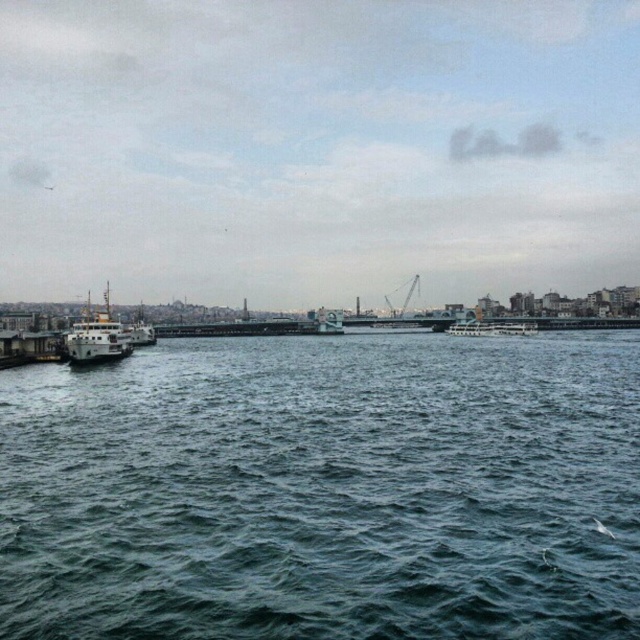
Which is more to the right, dark blue water at center or metallic gray crane at center?

Positioned to the right is metallic gray crane at center.

The height and width of the screenshot is (640, 640). What are the coordinates of `dark blue water at center` in the screenshot? It's located at [x=324, y=490].

Between white matte boat at left and metallic gray crane at center, which one has less height?

metallic gray crane at center is shorter.

Is white matte boat at left thinner than metallic gray crane at center?

In fact, white matte boat at left might be wider than metallic gray crane at center.

Which is behind, point (131, 346) or point (388, 305)?

The point (388, 305) is behind.

This screenshot has width=640, height=640. What are the coordinates of `white matte boat at left` in the screenshot? It's located at (97, 337).

Is dark blue water at center to the left of white matte boat at left from the viewer's perspective?

Incorrect, dark blue water at center is not on the left side of white matte boat at left.

Which of these two, dark blue water at center or white matte boat at left, stands shorter?

With less height is dark blue water at center.

I want to click on dark blue water at center, so click(324, 490).

Image resolution: width=640 pixels, height=640 pixels. I want to click on dark blue water at center, so click(x=324, y=490).